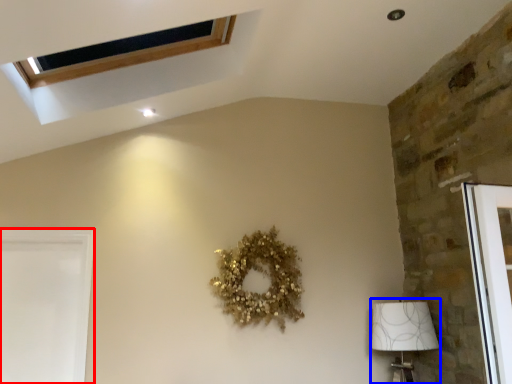
Question: Which object appears farthest to the camera in this image, screen door (highlighted by a red box) or lamp (highlighted by a blue box)?

Choices:
 (A) screen door
 (B) lamp

Answer: (B)